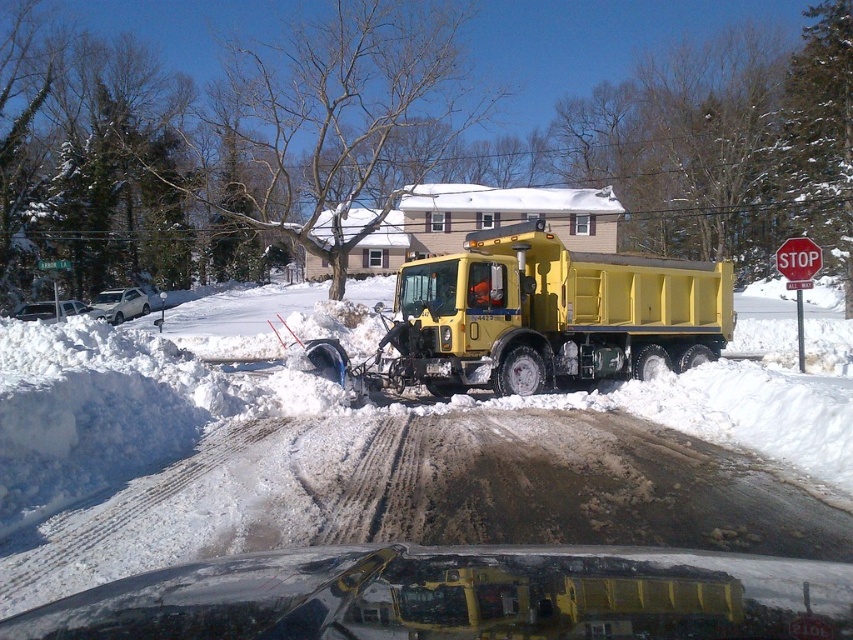
Question: Does white fluffy snow at center appear under red plastic stop sign at upper right?

Choices:
 (A) no
 (B) yes

Answer: (B)

Question: In this image, where is white fluffy snow at center located relative to red plastic stop sign at upper right?

Choices:
 (A) right
 (B) left

Answer: (B)

Question: Among these points, which one is nearest to the camera?

Choices:
 (A) (637, 273)
 (B) (787, 240)

Answer: (A)

Question: Considering the real-world distances, which object is closest to the white fluffy snow at center?

Choices:
 (A) yellow matte/snowplow at center
 (B) red plastic stop sign at upper right

Answer: (A)

Question: Is white fluffy snow at center to the left of yellow matte/snowplow at center from the viewer's perspective?

Choices:
 (A) yes
 (B) no

Answer: (A)

Question: Which object appears closest to the camera in this image?

Choices:
 (A) yellow matte/snowplow at center
 (B) red plastic stop sign at upper right

Answer: (A)